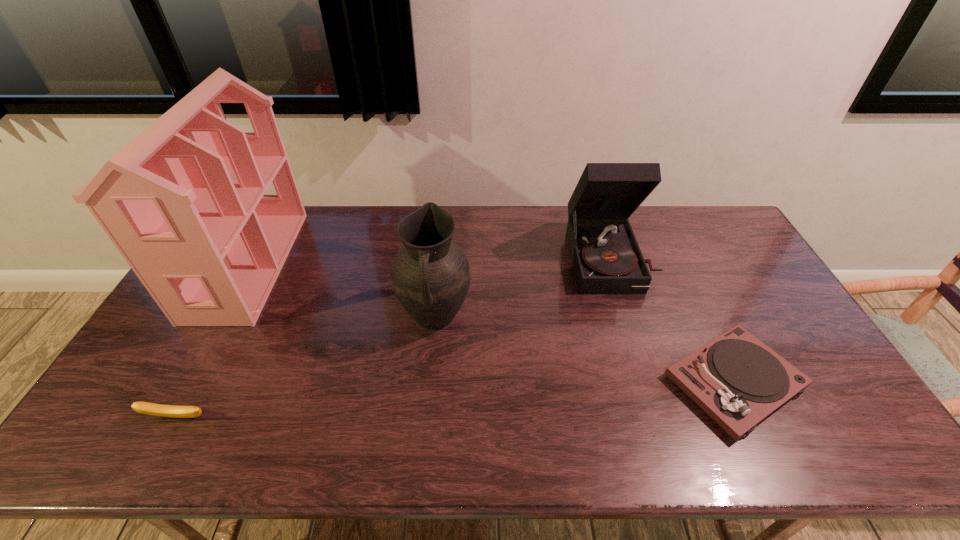
Locate an element on the screen. Image resolution: width=960 pixels, height=540 pixels. dollhouse is located at coordinates (183, 202).

Image resolution: width=960 pixels, height=540 pixels. I want to click on the farther phonograph_record, so click(606, 257).

You are a GUI agent. You are given a task and a screenshot of the screen. Output one action in this format:
    pyautogui.click(x=<x>, y=<y>)
    Task: Click on the pitcher
    Image resolution: width=960 pixels, height=540 pixels.
    Given the screenshot: What is the action you would take?
    pyautogui.click(x=430, y=274)

This screenshot has height=540, width=960. I want to click on the nearer phonograph_record, so click(x=736, y=379).

I want to click on banana, so click(x=174, y=411).

Locate an element on the screen. This screenshot has width=960, height=540. blank space located 0.160m on the front-facing side of the dollhouse is located at coordinates (334, 264).

I want to click on free space located 0.160m on the front-facing side of the farther phonograph_record, so [x=635, y=334].

Locate an element on the screen. free space located 0.300m on the side of the pitcher with the handle is located at coordinates (421, 454).

This screenshot has width=960, height=540. What are the coordinates of `vacant space located on the back of the shorter phonograph_record` in the screenshot? It's located at coord(686,284).

Identify the location of vacant space located at the stem of the banana. The height and width of the screenshot is (540, 960). tap(162, 444).